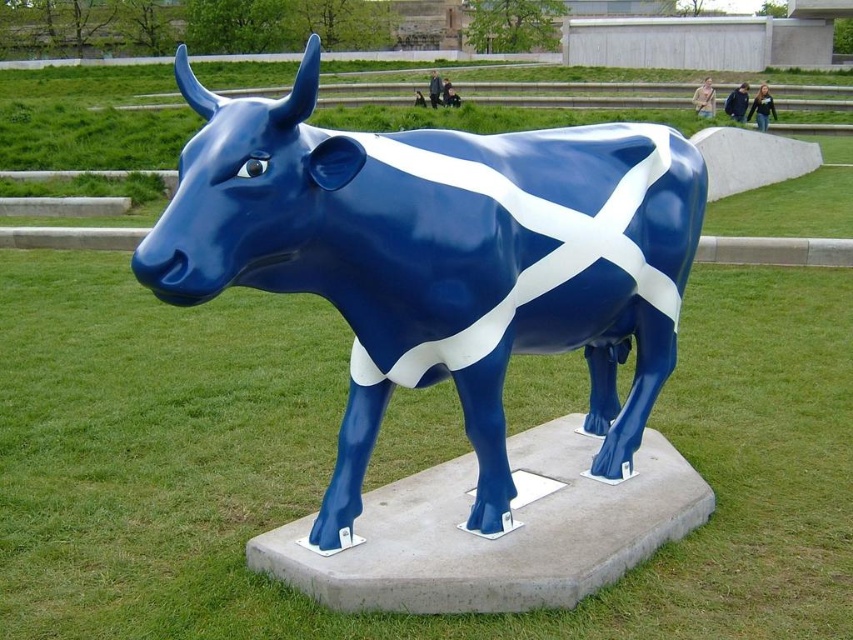
You are a photographer standing in front of the glossy blue bull at center and the green grass at center. Which object is closer to you?

The green grass at center is closer to you because it is further to the viewer than the glossy blue bull at center.

You are a gardener who wants to plant a new flowerbed between the green grass at center and the glossy blue bull at center. Based on their positions, which object should you start working near first?

The green grass at center is to the left of the glossy blue bull at center, so you should start working near the green grass at center first to create the flowerbed between them.